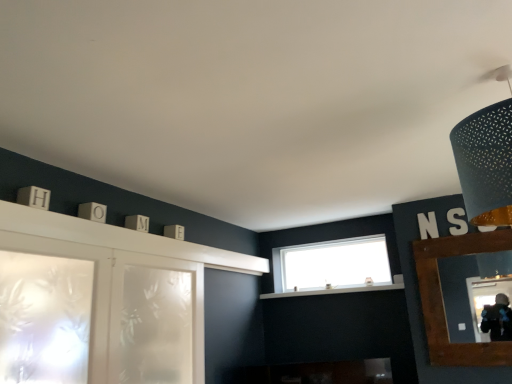
Question: Considering the relative sizes of matte black lampshade at upper right and frosted glass screen door at lower left in the image provided, is matte black lampshade at upper right smaller than frosted glass screen door at lower left?

Choices:
 (A) no
 (B) yes

Answer: (B)

Question: Is frosted glass screen door at lower left surrounded by matte black lampshade at upper right?

Choices:
 (A) no
 (B) yes

Answer: (A)

Question: Does matte black lampshade at upper right have a greater width compared to frosted glass screen door at lower left?

Choices:
 (A) no
 (B) yes

Answer: (B)

Question: Is matte black lampshade at upper right positioned with its back to frosted glass screen door at lower left?

Choices:
 (A) no
 (B) yes

Answer: (B)

Question: Is matte black lampshade at upper right positioned beyond the bounds of frosted glass screen door at lower left?

Choices:
 (A) no
 (B) yes

Answer: (B)

Question: From the image's perspective, is white glossy mantle at center above or below brown wooden mirror at right?

Choices:
 (A) below
 (B) above

Answer: (A)

Question: Based on their positions, is white glossy mantle at center located to the left or right of brown wooden mirror at right?

Choices:
 (A) right
 (B) left

Answer: (B)

Question: Considering the positions of white glossy mantle at center and brown wooden mirror at right in the image, is white glossy mantle at center bigger or smaller than brown wooden mirror at right?

Choices:
 (A) big
 (B) small

Answer: (A)

Question: From a real-world perspective, is white glossy mantle at center positioned above or below brown wooden mirror at right?

Choices:
 (A) below
 (B) above

Answer: (B)

Question: Is point (478, 205) closer or farther from the camera than point (309, 279)?

Choices:
 (A) closer
 (B) farther

Answer: (A)

Question: From a real-world perspective, is matte black lampshade at upper right positioned above or below clear glass window at center?

Choices:
 (A) below
 (B) above

Answer: (B)

Question: Is matte black lampshade at upper right bigger or smaller than clear glass window at center?

Choices:
 (A) big
 (B) small

Answer: (A)

Question: Considering the positions of matte black lampshade at upper right and clear glass window at center in the image, is matte black lampshade at upper right wider or thinner than clear glass window at center?

Choices:
 (A) thin
 (B) wide

Answer: (B)

Question: Based on their sizes in the image, would you say frosted glass screen door at lower left is bigger or smaller than matte black lampshade at upper right?

Choices:
 (A) small
 (B) big

Answer: (B)

Question: From the image's perspective, is frosted glass screen door at lower left above or below matte black lampshade at upper right?

Choices:
 (A) above
 (B) below

Answer: (B)